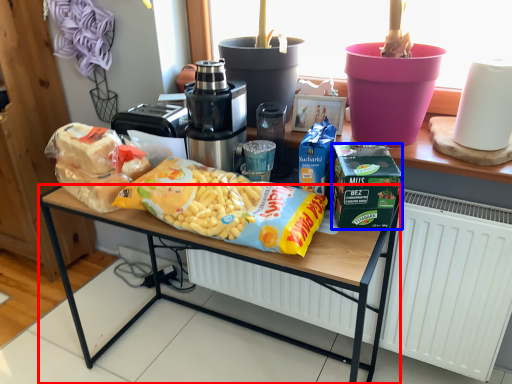
Question: Which object appears farthest to the camera in this image, desk (highlighted by a red box) or lunch box (highlighted by a blue box)?

Choices:
 (A) desk
 (B) lunch box

Answer: (B)